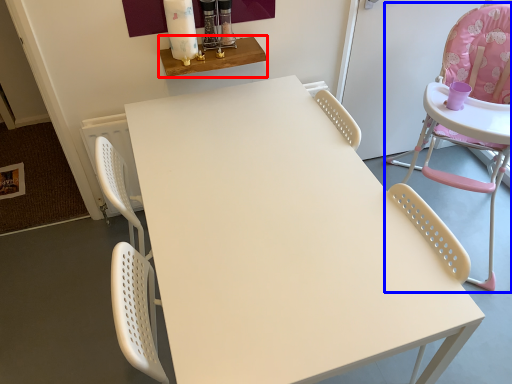
Question: Among these objects, which one is nearest to the camera, table (highlighted by a red box) or chair (highlighted by a blue box)?

Choices:
 (A) table
 (B) chair

Answer: (B)